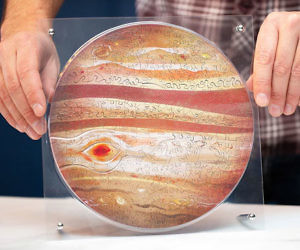
Where is `table`? The image size is (300, 250). table is located at coordinates (280, 238).